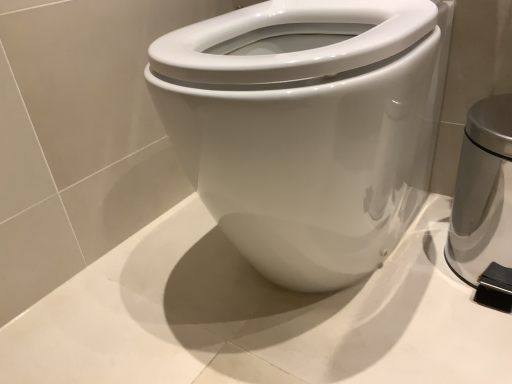
Question: Should I look upward or downward to see satin silver trash can at right?

Choices:
 (A) up
 (B) down

Answer: (A)

Question: Can you confirm if satin silver trash can at right is positioned to the left of white glossy bidet at center?

Choices:
 (A) yes
 (B) no

Answer: (B)

Question: From a real-world perspective, is satin silver trash can at right on top of white glossy bidet at center?

Choices:
 (A) yes
 (B) no

Answer: (B)

Question: Is satin silver trash can at right at the right side of white glossy bidet at center?

Choices:
 (A) no
 (B) yes

Answer: (B)

Question: Is satin silver trash can at right not inside white glossy bidet at center?

Choices:
 (A) no
 (B) yes

Answer: (B)

Question: Is satin silver trash can at right behind white glossy bidet at center?

Choices:
 (A) no
 (B) yes

Answer: (B)

Question: Is satin silver trash can at right wider than white glossy bidet at center?

Choices:
 (A) no
 (B) yes

Answer: (A)

Question: Is white glossy bidet at center touching satin silver trash can at right?

Choices:
 (A) yes
 (B) no

Answer: (B)

Question: From the image's perspective, is white glossy bidet at center located above satin silver trash can at right?

Choices:
 (A) yes
 (B) no

Answer: (A)

Question: Considering the relative positions of white glossy bidet at center and satin silver trash can at right in the image provided, is white glossy bidet at center to the left of satin silver trash can at right from the viewer's perspective?

Choices:
 (A) no
 (B) yes

Answer: (B)

Question: Is white glossy bidet at center facing away from satin silver trash can at right?

Choices:
 (A) yes
 (B) no

Answer: (B)

Question: Could you tell me if white glossy bidet at center is turned towards satin silver trash can at right?

Choices:
 (A) no
 (B) yes

Answer: (A)

Question: Does white glossy bidet at center have a lesser height compared to satin silver trash can at right?

Choices:
 (A) yes
 (B) no

Answer: (B)

Question: Based on their sizes in the image, would you say satin silver trash can at right is bigger or smaller than white glossy bidet at center?

Choices:
 (A) big
 (B) small

Answer: (B)